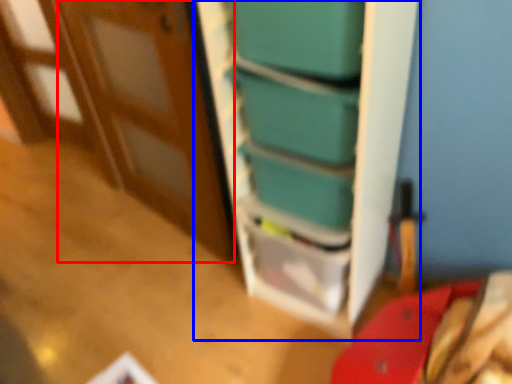
Question: Which object is closer to the camera taking this photo, door (highlighted by a red box) or bookshelf (highlighted by a blue box)?

Choices:
 (A) door
 (B) bookshelf

Answer: (B)